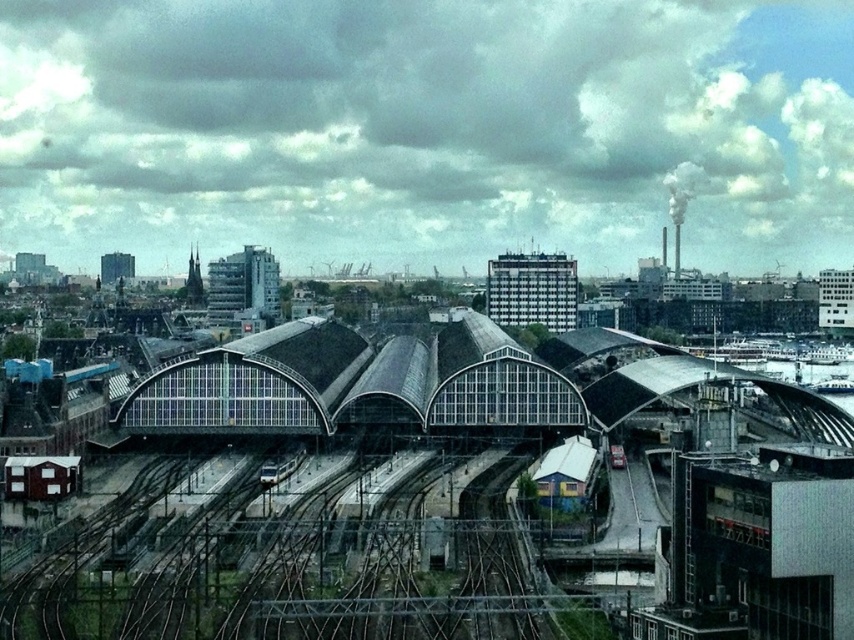
Question: Can you confirm if metallic gray train tracks at center is wider than silver metallic train at center?

Choices:
 (A) yes
 (B) no

Answer: (A)

Question: Considering the relative positions of metallic gray train tracks at center and silver metallic train at center in the image provided, where is metallic gray train tracks at center located with respect to silver metallic train at center?

Choices:
 (A) above
 (B) below

Answer: (B)

Question: Can you confirm if metallic gray train tracks at center is positioned to the left of silver metallic train at center?

Choices:
 (A) yes
 (B) no

Answer: (B)

Question: Which object appears farthest from the camera in this image?

Choices:
 (A) metallic gray train tracks at center
 (B) silver metallic train at center

Answer: (B)